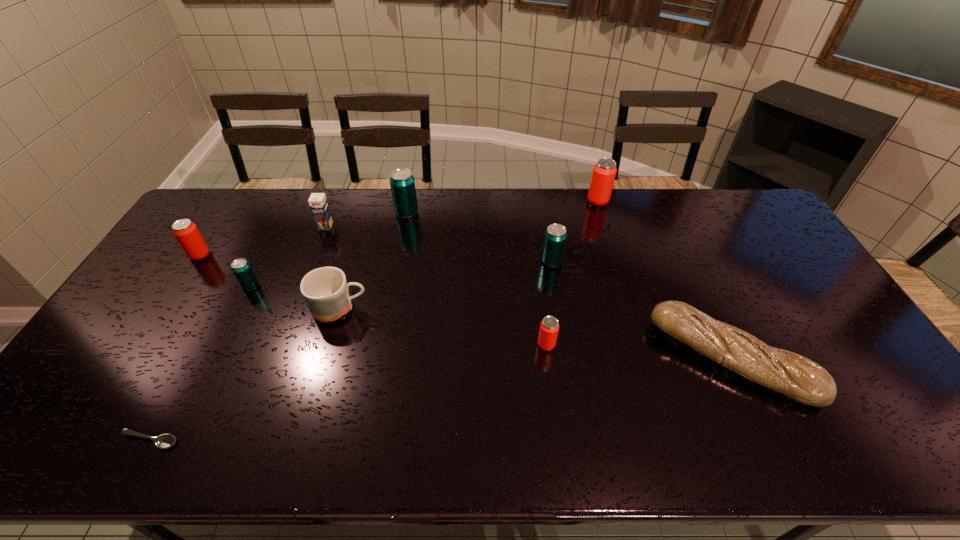
Identify the location of the rightmost beer can. pos(604,171).

Find the location of a particular element. This screenshot has height=540, width=960. the biggest red beer can is located at coordinates (604, 171).

In order to click on the biggest teal beer can in this screenshot , I will do `click(402, 182)`.

This screenshot has height=540, width=960. Identify the location of the fourth beer can from right to left. (402, 182).

Where is `the eighth nearest object`? The image size is (960, 540). the eighth nearest object is located at coordinates (318, 203).

Where is `chocolate milk`? The width and height of the screenshot is (960, 540). chocolate milk is located at coordinates (318, 203).

What are the coordinates of `the second biggest teal beer can` in the screenshot? It's located at (555, 237).

This screenshot has height=540, width=960. I want to click on the rightmost teal beer can, so click(x=555, y=237).

Where is `the leftmost red beer can`? Image resolution: width=960 pixels, height=540 pixels. the leftmost red beer can is located at coordinates (185, 231).

Identify the location of the second biggest red beer can. Image resolution: width=960 pixels, height=540 pixels. (185, 231).